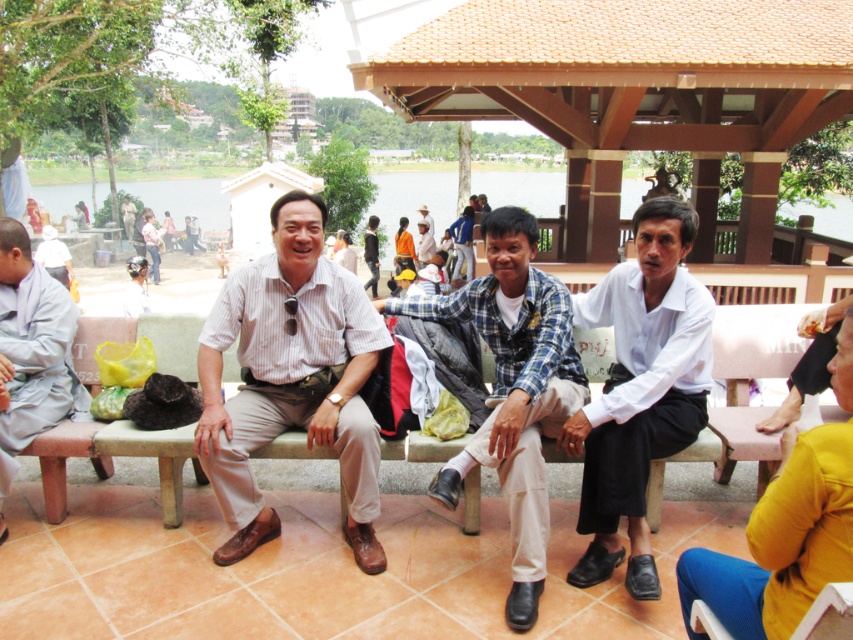
Question: Can you confirm if white cotton shirt at center is positioned above blue plaid shirt at center?

Choices:
 (A) no
 (B) yes

Answer: (B)

Question: Estimate the real-world distances between objects in this image. Which object is closer to the blue plaid shirt at center?

Choices:
 (A) white striped shirt at center
 (B) light gray monk robe at left

Answer: (A)

Question: Considering the relative positions of blue plaid shirt at center and light gray monk robe at left in the image provided, where is blue plaid shirt at center located with respect to light gray monk robe at left?

Choices:
 (A) left
 (B) right

Answer: (B)

Question: Can you confirm if white striped shirt at center is wider than blue plaid shirt at center?

Choices:
 (A) no
 (B) yes

Answer: (A)

Question: Which point is farther to the camera?

Choices:
 (A) (556, 340)
 (B) (329, 260)
 (C) (21, 387)
 (D) (682, 202)

Answer: (C)

Question: Which of the following is the farthest from the observer?

Choices:
 (A) (231, 451)
 (B) (32, 436)
 (C) (654, 252)
 (D) (512, 627)

Answer: (B)